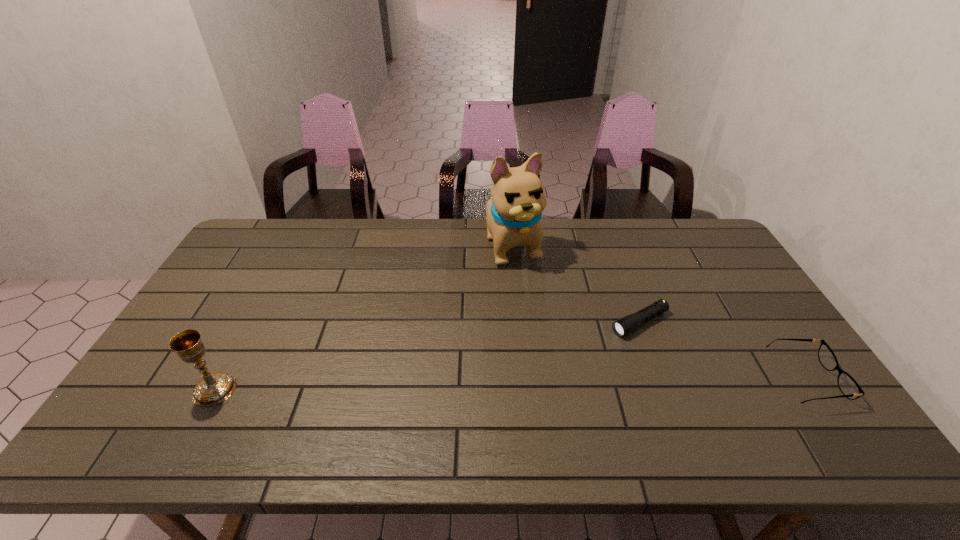
The height and width of the screenshot is (540, 960). Find the location of `free space on the desktop that is between the leftmost object and the spectacles and is positioned at the lens end of the third object from left to right`. free space on the desktop that is between the leftmost object and the spectacles and is positioned at the lens end of the third object from left to right is located at coordinates (527, 383).

You are a GUI agent. You are given a task and a screenshot of the screen. Output one action in this format:
    pyautogui.click(x=<x>, y=<y>)
    Task: Click on the free space on the desktop that is between the chalice and the rightmost object and is positioned on the face of the third object from right to left
    The image size is (960, 540).
    Given the screenshot: What is the action you would take?
    pyautogui.click(x=588, y=382)